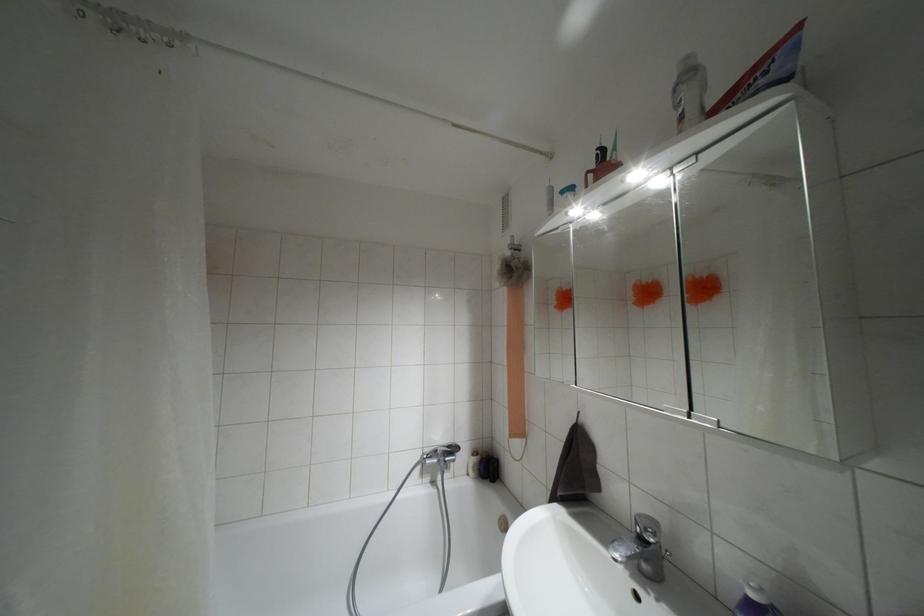
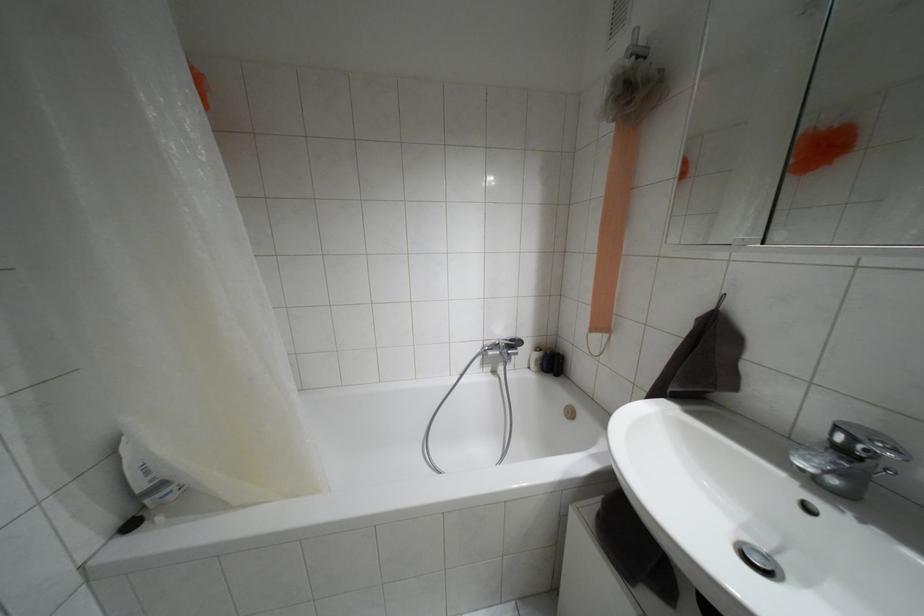
Question: The images are taken continuously from a first-person perspective. In which direction is your viewpoint rotating?

Choices:
 (A) Left
 (B) Right
 (C) Up
 (D) Down

Answer: (D)